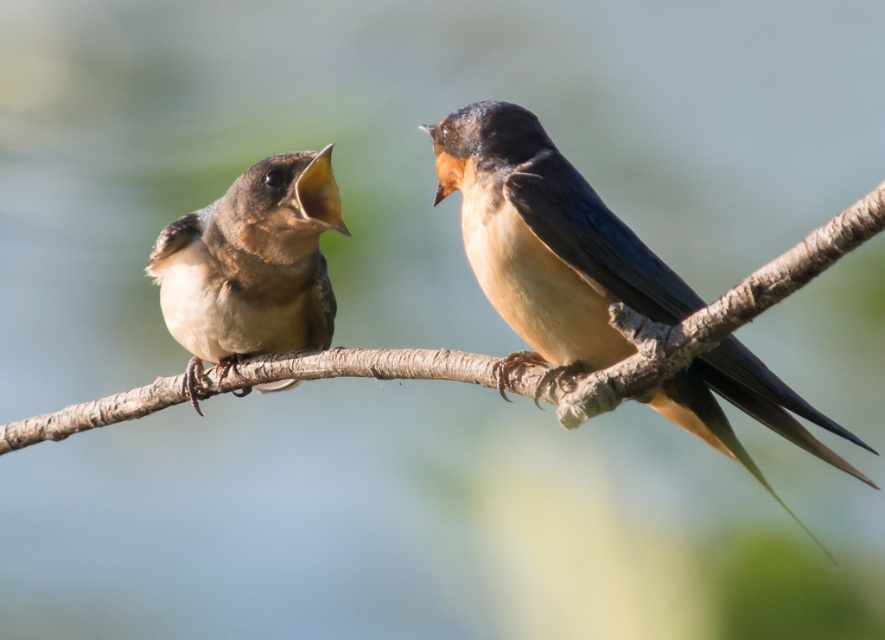
You are a photographer who wants to focus on the bird on the right. You notice two points in the image labeled as point A and point B. Point A is at coordinate [832,461] and point B is at coordinate [328,170]. Which point should you adjust your focus to ensure the bird on the right is in sharp focus?

Point A at coordinate [832,461] is closer to the viewer than point B at coordinate [328,170]. Therefore, to focus on the bird on the right, you should adjust your focus to point A as it is closer and likely part of the bird on the right.

You are a wildlife photographer aiming to capture a closeup of the brown glossy swallow at right and the brown matte bird at left. Based on their positions, which bird would appear more in focus if you focus on the branch they are both perched on?

The brown glossy swallow at right is in front of the brown matte bird at left, so focusing on the branch would make the brown glossy swallow at right appear more in focus.

You are standing at the camera position and want to take a photo of the two barn swallows. The camera has a focus range of 5 feet. Can you focus on the point at coordinates point (701, 305) without adjusting your position?

The distance between point (701, 305) and the camera is 6.62 feet, which exceeds the camera focus range of 5 feet. Therefore, you cannot focus on the point at coordinates point (701, 305) without adjusting your position.